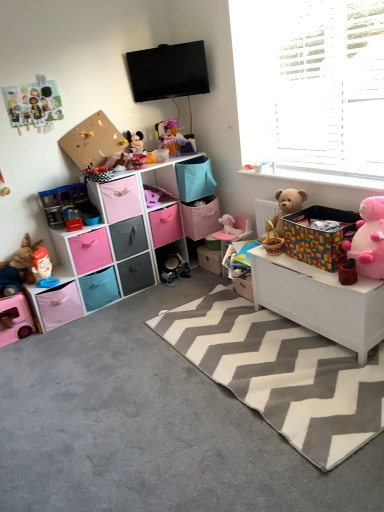
Image resolution: width=384 pixels, height=512 pixels. Find the location of `vacant space to the right of pink fabric drawer at lower left, the 1th drawer positioned from the bottom`. vacant space to the right of pink fabric drawer at lower left, the 1th drawer positioned from the bottom is located at coordinates (135, 303).